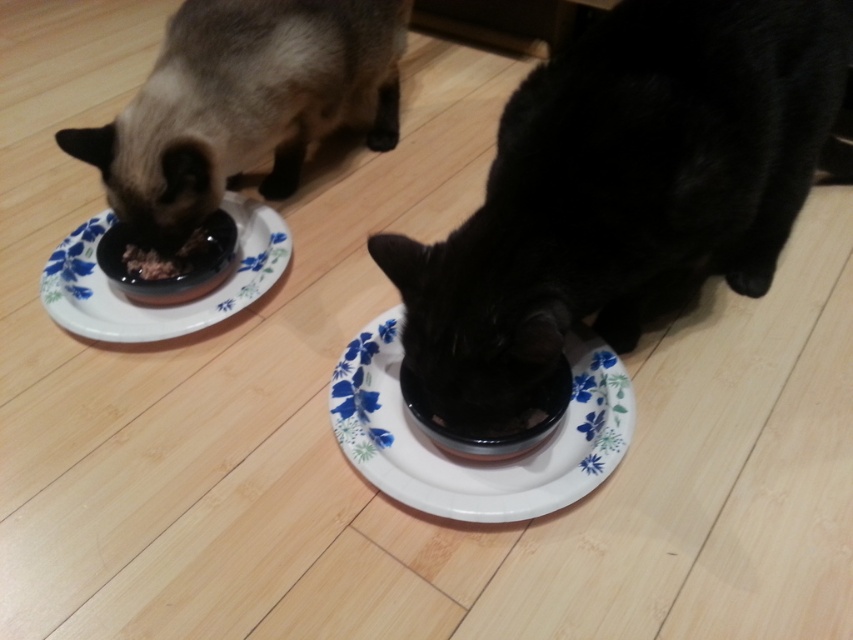
Based on the photo, you are a cat owner who wants to place a new toy between the white glossy plate at center and the white floral plate at left. Based on their positions, which plate should the toy be closer to?

The white glossy plate at center is in front of the white floral plate at left, so the toy should be placed closer to the white glossy plate at center since it is positioned forward.

You are a cat owner who wants to ensure both cats have enough food. You notice the black glossy bowl at lower center and the brown matte food at left. Which bowl has a larger capacity?

The black glossy bowl at lower center is bigger than the brown matte food at left, so it has a larger capacity.